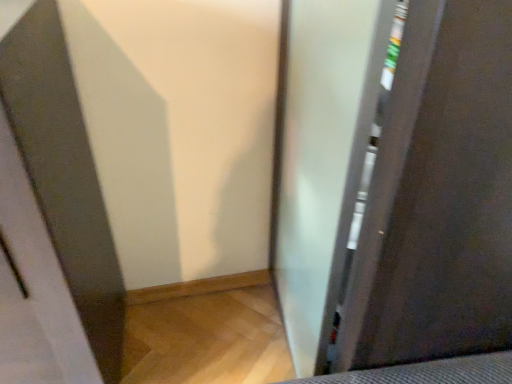
This screenshot has width=512, height=384. Describe the element at coordinates (438, 196) in the screenshot. I see `frosted glass screen door at right, the 2th screen door when ordered from left to right` at that location.

Identify the location of frosted glass screen door at right, arranged as the first screen door when viewed from the right. This screenshot has height=384, width=512. pyautogui.click(x=438, y=196).

The image size is (512, 384). Describe the element at coordinates (64, 175) in the screenshot. I see `clear glass screen door at left, which ranks as the second screen door in right-to-left order` at that location.

Where is `clear glass screen door at left, which ranks as the second screen door in right-to-left order`? clear glass screen door at left, which ranks as the second screen door in right-to-left order is located at coordinates coord(64,175).

Identify the location of frosted glass screen door at right, arranged as the first screen door when viewed from the right. The image size is (512, 384). (438, 196).

Does clear glass screen door at left, acting as the first screen door starting from the left, appear on the right side of frosted glass screen door at right, arranged as the first screen door when viewed from the right?

No, clear glass screen door at left, acting as the first screen door starting from the left, is not to the right of frosted glass screen door at right, arranged as the first screen door when viewed from the right.

Based on the photo, is clear glass screen door at left, which ranks as the second screen door in right-to-left order, further to the viewer compared to frosted glass screen door at right, arranged as the first screen door when viewed from the right?

No, it is not.

Is point (56, 8) closer to viewer compared to point (454, 272)?

No, it is behind (454, 272).

From the image's perspective, is clear glass screen door at left, acting as the first screen door starting from the left, over frosted glass screen door at right, the 2th screen door when ordered from left to right?

Incorrect, from the image's perspective, clear glass screen door at left, acting as the first screen door starting from the left, is lower than frosted glass screen door at right, the 2th screen door when ordered from left to right.

Based on the photo, from a real-world perspective, is clear glass screen door at left, which ranks as the second screen door in right-to-left order, on top of frosted glass screen door at right, the 2th screen door when ordered from left to right?

No, from a real-world perspective, clear glass screen door at left, which ranks as the second screen door in right-to-left order, is not over frosted glass screen door at right, the 2th screen door when ordered from left to right

Is clear glass screen door at left, acting as the first screen door starting from the left, wider or thinner than frosted glass screen door at right, the 2th screen door when ordered from left to right?

clear glass screen door at left, acting as the first screen door starting from the left, is wider than frosted glass screen door at right, the 2th screen door when ordered from left to right.

Which of these two, clear glass screen door at left, acting as the first screen door starting from the left, or frosted glass screen door at right, arranged as the first screen door when viewed from the right, stands taller?

With more height is frosted glass screen door at right, arranged as the first screen door when viewed from the right.

Does clear glass screen door at left, which ranks as the second screen door in right-to-left order, have a smaller size compared to frosted glass screen door at right, the 2th screen door when ordered from left to right?

No.

Is clear glass screen door at left, which ranks as the second screen door in right-to-left order, not inside frosted glass screen door at right, arranged as the first screen door when viewed from the right?

clear glass screen door at left, which ranks as the second screen door in right-to-left order, lies outside frosted glass screen door at right, arranged as the first screen door when viewed from the right,'s area.

Does clear glass screen door at left, which ranks as the second screen door in right-to-left order, touch frosted glass screen door at right, arranged as the first screen door when viewed from the right?

No, clear glass screen door at left, which ranks as the second screen door in right-to-left order, is not next to frosted glass screen door at right, arranged as the first screen door when viewed from the right.

Is clear glass screen door at left, acting as the first screen door starting from the left, turned away from frosted glass screen door at right, the 2th screen door when ordered from left to right?

No.

Can you tell me how much clear glass screen door at left, which ranks as the second screen door in right-to-left order, and frosted glass screen door at right, the 2th screen door when ordered from left to right, differ in facing direction?

The angular difference between clear glass screen door at left, which ranks as the second screen door in right-to-left order, and frosted glass screen door at right, the 2th screen door when ordered from left to right, is 90 degrees.

In order to click on screen door that is under the frosted glass screen door at right, arranged as the first screen door when viewed from the right (from a real-world perspective) in this screenshot , I will do `click(64, 175)`.

Is frosted glass screen door at right, the 2th screen door when ordered from left to right, at the right side of clear glass screen door at left, acting as the first screen door starting from the left?

Indeed, frosted glass screen door at right, the 2th screen door when ordered from left to right, is positioned on the right side of clear glass screen door at left, acting as the first screen door starting from the left.

Is frosted glass screen door at right, the 2th screen door when ordered from left to right, in front of or behind clear glass screen door at left, acting as the first screen door starting from the left, in the image?

frosted glass screen door at right, the 2th screen door when ordered from left to right, is behind clear glass screen door at left, acting as the first screen door starting from the left.

Which point is more distant from viewer, [449,126] or [81,291]?

The point [81,291] is farther from the camera.

From the image's perspective, is frosted glass screen door at right, arranged as the first screen door when viewed from the right, located beneath clear glass screen door at left, which ranks as the second screen door in right-to-left order?

Actually, frosted glass screen door at right, arranged as the first screen door when viewed from the right, appears above clear glass screen door at left, which ranks as the second screen door in right-to-left order, in the image.

From a real-world perspective, is frosted glass screen door at right, the 2th screen door when ordered from left to right, located beneath clear glass screen door at left, which ranks as the second screen door in right-to-left order?

No.

Looking at their sizes, would you say frosted glass screen door at right, arranged as the first screen door when viewed from the right, is wider or thinner than clear glass screen door at left, acting as the first screen door starting from the left?

Answer: Considering their sizes, frosted glass screen door at right, arranged as the first screen door when viewed from the right, looks slimmer than clear glass screen door at left, acting as the first screen door starting from the left.

Is frosted glass screen door at right, the 2th screen door when ordered from left to right, shorter than clear glass screen door at left, acting as the first screen door starting from the left?

No.

Is frosted glass screen door at right, the 2th screen door when ordered from left to right, bigger than clear glass screen door at left, acting as the first screen door starting from the left?

Actually, frosted glass screen door at right, the 2th screen door when ordered from left to right, might be smaller than clear glass screen door at left, acting as the first screen door starting from the left.

Is clear glass screen door at left, which ranks as the second screen door in right-to-left order, inside frosted glass screen door at right, the 2th screen door when ordered from left to right?

Actually, clear glass screen door at left, which ranks as the second screen door in right-to-left order, is outside frosted glass screen door at right, the 2th screen door when ordered from left to right.

Is frosted glass screen door at right, the 2th screen door when ordered from left to right, positioned far away from clear glass screen door at left, acting as the first screen door starting from the left?

No, frosted glass screen door at right, the 2th screen door when ordered from left to right, is not far away from clear glass screen door at left, acting as the first screen door starting from the left.

Is frosted glass screen door at right, the 2th screen door when ordered from left to right, looking in the opposite direction of clear glass screen door at left, which ranks as the second screen door in right-to-left order?

Yes, clear glass screen door at left, which ranks as the second screen door in right-to-left order, is at the back of frosted glass screen door at right, the 2th screen door when ordered from left to right.

This screenshot has width=512, height=384. What are the coordinates of `screen door below the frosted glass screen door at right, arranged as the first screen door when viewed from the right (from a real-world perspective)` in the screenshot? It's located at (64, 175).

This screenshot has height=384, width=512. I want to click on screen door on the left of frosted glass screen door at right, the 2th screen door when ordered from left to right, so click(64, 175).

Locate an element on the screen. The width and height of the screenshot is (512, 384). screen door behind the clear glass screen door at left, which ranks as the second screen door in right-to-left order is located at coordinates (438, 196).